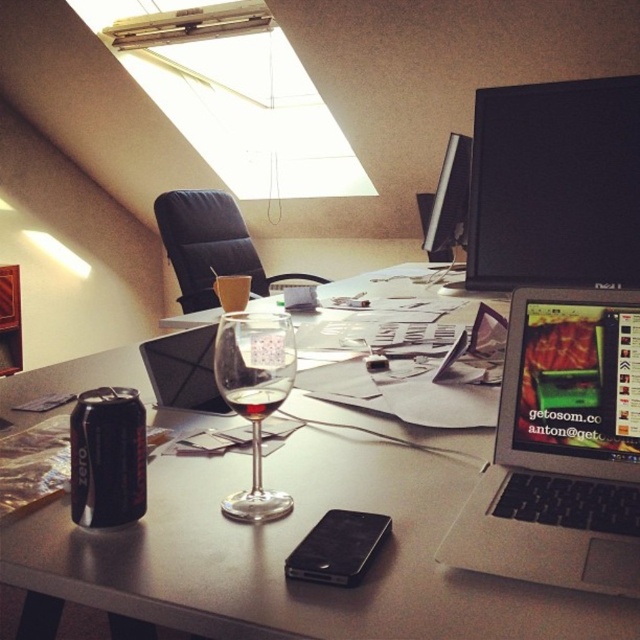
Between silver metallic laptop at right and black matte can at center-left, which one has more height?

With more height is silver metallic laptop at right.

Between silver metallic laptop at right and black matte can at center-left, which one appears on the right side from the viewer's perspective?

From the viewer's perspective, silver metallic laptop at right appears more on the right side.

Is point (616, 561) positioned behind point (129, 404)?

No.

At what (x,y) coordinates should I click in order to perform the action: click on silver metallic laptop at right. Please return your answer as a coordinate pair (x, y). The width and height of the screenshot is (640, 640). Looking at the image, I should click on (561, 449).

In the scene shown: Who is positioned more to the left, silver metallic laptop at right or satin black monitor at upper center?

From the viewer's perspective, silver metallic laptop at right appears more on the left side.

Can you confirm if silver metallic laptop at right is taller than satin black monitor at upper center?

Incorrect, silver metallic laptop at right's height is not larger of satin black monitor at upper center's.

At what (x,y) coordinates should I click in order to perform the action: click on silver metallic laptop at right. Please return your answer as a coordinate pair (x, y). The image size is (640, 640). Looking at the image, I should click on (561, 449).

Identify the location of silver metallic laptop at right. The height and width of the screenshot is (640, 640). (561, 449).

Is black matte can at center-left shorter than satin black monitor at upper center?

Yes.

Can you confirm if black matte can at center-left is positioned to the right of satin black monitor at upper center?

No, black matte can at center-left is not to the right of satin black monitor at upper center.

This screenshot has height=640, width=640. What do you see at coordinates (108, 458) in the screenshot?
I see `black matte can at center-left` at bounding box center [108, 458].

Locate an element on the screen. The image size is (640, 640). black matte can at center-left is located at coordinates (108, 458).